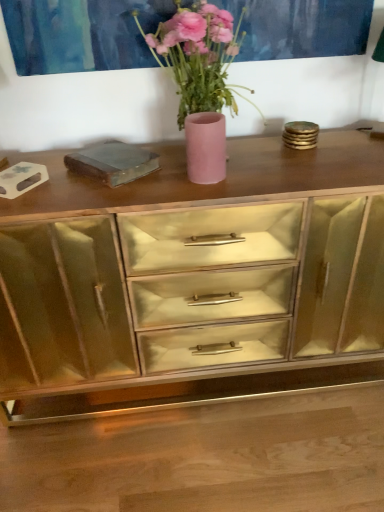
At what (x,y) coordinates should I click in order to perform the action: click on unoccupied area in front of pink matte vase at center. Please return your answer as a coordinate pair (x, y). The image size is (384, 512). Looking at the image, I should click on (201, 193).